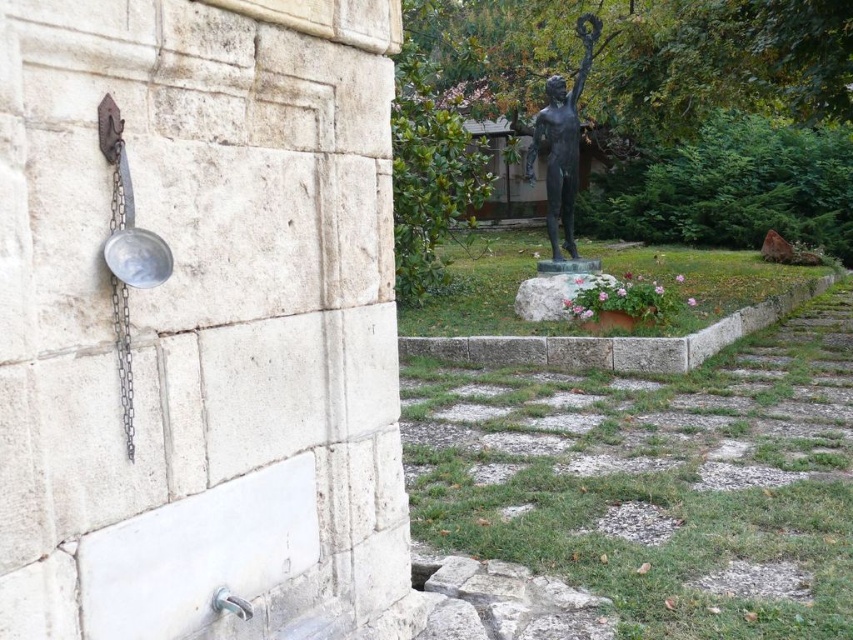
You are a visitor standing in front of the bronze statue at center and the white stone at center. Which object is closer to you?

The bronze statue at center is closer to you because the white stone at center is behind it.

Consider the image. You are standing in the outdoor scene described. There are two points marked in the image, point (553,184) and point (567,276). If you were to walk towards both points, which one would you reach first?

Point (553,184) is closer to you than point (567,276), so you would reach point (553,184) first.

You are an artist planning to paint this scene. You want to ensure the bronze statue at center and the white stone at center are proportionally accurate. Which object should you draw larger in your painting?

The bronze statue at center should be drawn larger than the white stone at center because the bronze statue at center is bigger than the white stone at center.